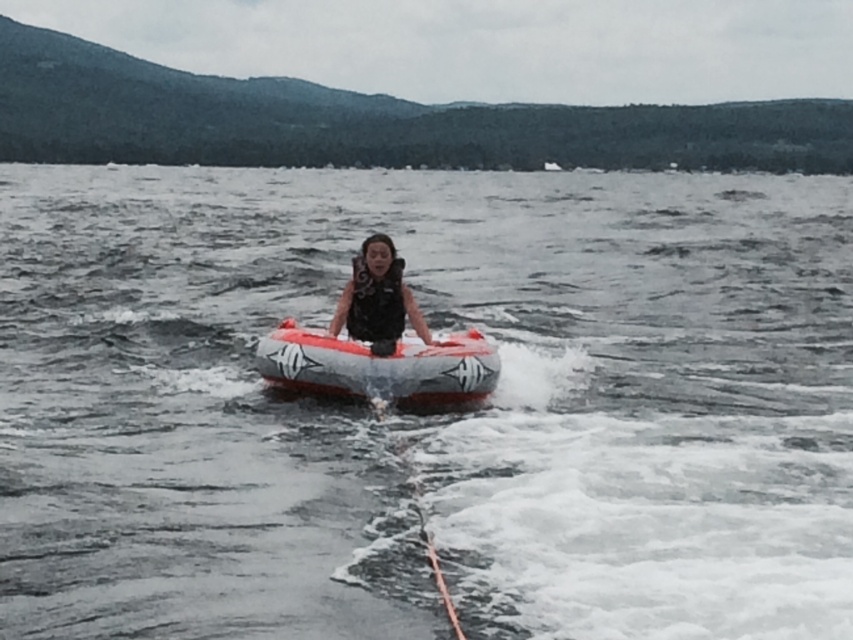
You are standing on the shore of the lake and see the black matte life vest at center. If you want to throw a lifebuoy to someone in the water near the life vest, will it reach them?

The black matte life vest at center is 12.88 meters away from the viewer, so if the lifebuoy can reach at least 12.88 meters, it will reach them.

You are a safety inspector checking the equipment of a water sports participant. You notice two black matte items at the center of the image. Which one is closer to you, the black matte life vest at center or the black matte life jacket at center?

The black matte life vest at center is closer to you because it is further to the viewer than the black matte life jacket at center.